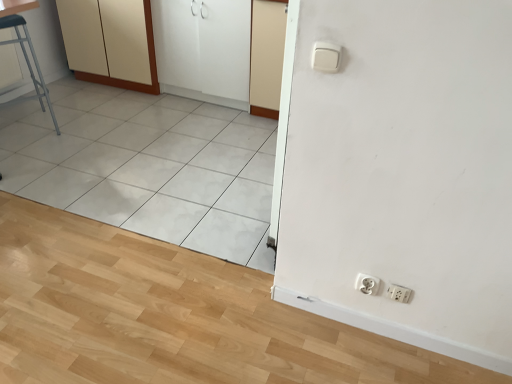
Question: From the image's perspective, is white matte screen door at upper center, which appears as the first screen door when viewed from the right, beneath white plastic socket at lower right, which is counted as the second socket, starting from the right?

Choices:
 (A) yes
 (B) no

Answer: (B)

Question: Can you confirm if white matte screen door at upper center, which ranks as the second screen door in left-to-right order, is bigger than white plastic socket at lower right, which is counted as the first socket, starting from the left?

Choices:
 (A) yes
 (B) no

Answer: (A)

Question: Does white matte screen door at upper center, which appears as the first screen door when viewed from the right, come behind white plastic socket at lower right, which is counted as the second socket, starting from the right?

Choices:
 (A) no
 (B) yes

Answer: (B)

Question: Considering the relative sizes of white matte screen door at upper center, which ranks as the second screen door in left-to-right order, and white plastic socket at lower right, which is counted as the first socket, starting from the left, in the image provided, is white matte screen door at upper center, which ranks as the second screen door in left-to-right order, smaller than white plastic socket at lower right, which is counted as the first socket, starting from the left,?

Choices:
 (A) no
 (B) yes

Answer: (A)

Question: Would you say white matte screen door at upper center, which ranks as the second screen door in left-to-right order, contains white plastic socket at lower right, which is counted as the first socket, starting from the left?

Choices:
 (A) yes
 (B) no

Answer: (B)

Question: Could you tell me if white matte screen door at upper center, which ranks as the second screen door in left-to-right order, is turned towards white plastic socket at lower right, which is counted as the second socket, starting from the right?

Choices:
 (A) yes
 (B) no

Answer: (B)

Question: From the image's perspective, does white plastic socket at lower right, which is counted as the second socket, starting from the right, appear higher than white plastic socket at lower right, which ranks as the second socket in left-to-right order?

Choices:
 (A) yes
 (B) no

Answer: (A)

Question: Would you say white plastic socket at lower right, which is counted as the first socket, starting from the left, is outside white plastic socket at lower right, placed as the first socket when sorted from right to left?

Choices:
 (A) yes
 (B) no

Answer: (A)

Question: Is white plastic socket at lower right, which is counted as the first socket, starting from the left, wider than white plastic socket at lower right, placed as the first socket when sorted from right to left?

Choices:
 (A) yes
 (B) no

Answer: (A)

Question: From a real-world perspective, is white plastic socket at lower right, which is counted as the first socket, starting from the left, beneath white plastic socket at lower right, placed as the first socket when sorted from right to left?

Choices:
 (A) yes
 (B) no

Answer: (B)

Question: From the image's perspective, is white plastic socket at lower right, which is counted as the second socket, starting from the right, under white plastic socket at lower right, placed as the first socket when sorted from right to left?

Choices:
 (A) no
 (B) yes

Answer: (A)

Question: Is white plastic socket at lower right, which is counted as the first socket, starting from the left, at the left side of white plastic socket at lower right, which ranks as the second socket in left-to-right order?

Choices:
 (A) no
 (B) yes

Answer: (B)

Question: Is white plastic socket at lower right, which is counted as the first socket, starting from the left, outside of white glossy cabinet at upper left, arranged as the 1th screen door when viewed from the left?

Choices:
 (A) yes
 (B) no

Answer: (A)